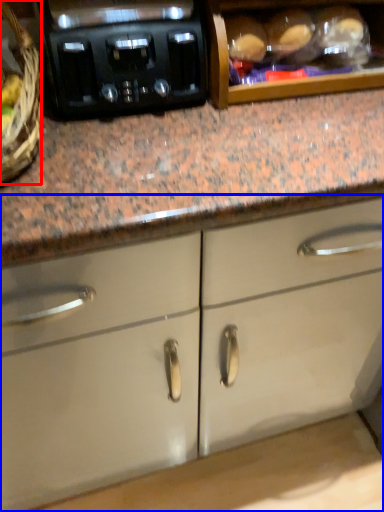
Question: Which object is closer to the camera taking this photo, basket (highlighted by a red box) or cabinetry (highlighted by a blue box)?

Choices:
 (A) basket
 (B) cabinetry

Answer: (A)